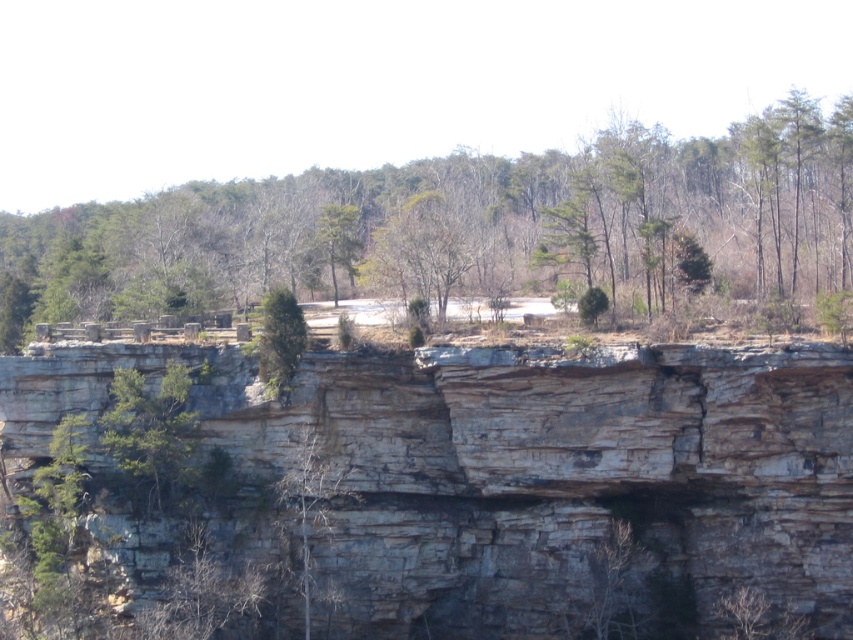
Between gray rock cliff at center and green textured tree at center, which one has less height?

green textured tree at center

Who is more distant from viewer, (335,630) or (294,323)?

The point (294,323) is behind.

Which is behind, point (541, 365) or point (283, 392)?

Point (283, 392)

You are a GUI agent. You are given a task and a screenshot of the screen. Output one action in this format:
    pyautogui.click(x=<x>, y=<y>)
    Task: Click on the gray rock cliff at center
    
    Given the screenshot: What is the action you would take?
    pyautogui.click(x=523, y=474)

Does gray rock cliff at center come behind green leafy tree at center?

No, gray rock cliff at center is closer to the viewer.

Is point (566, 396) closer to viewer compared to point (368, 244)?

Yes.

You are a GUI agent. You are given a task and a screenshot of the screen. Output one action in this format:
    pyautogui.click(x=<x>, y=<y>)
    Task: Click on the gray rock cliff at center
    The height and width of the screenshot is (640, 853).
    Given the screenshot: What is the action you would take?
    pyautogui.click(x=523, y=474)

Which is in front, point (184, 419) or point (260, 336)?

Point (184, 419)

Find the location of a particular element. green leafy tree at left is located at coordinates (151, 438).